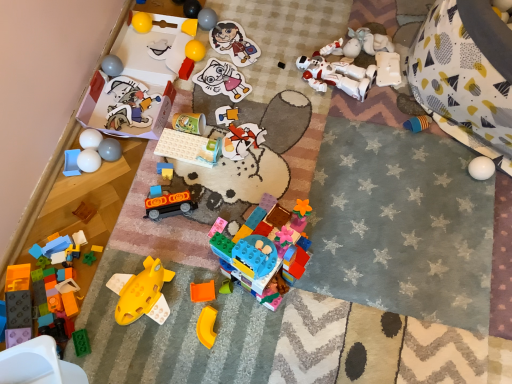
This screenshot has width=512, height=384. In order to click on free spot to the right of black plastic train at center, which is counted as the tenth toy, starting from the left in this screenshot , I will do `click(221, 200)`.